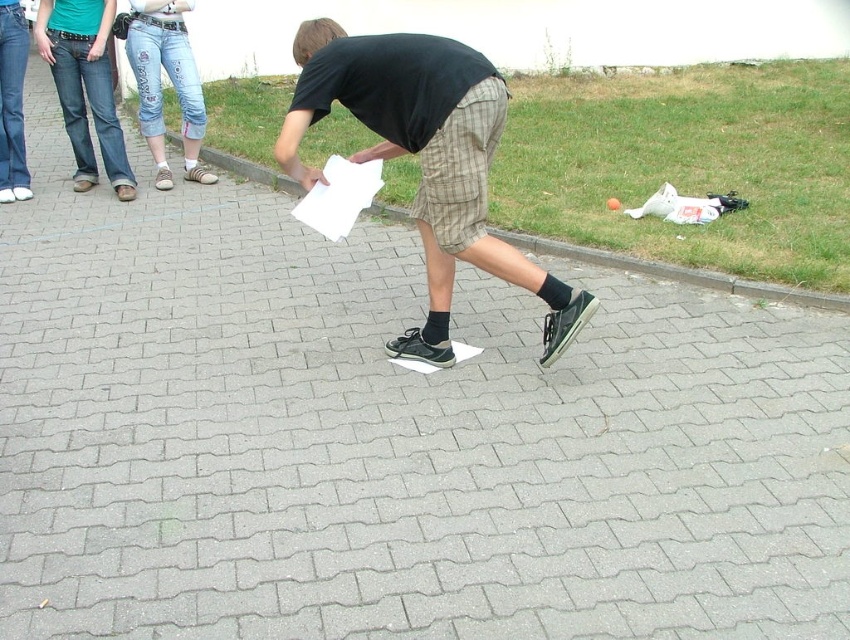
Question: Considering the relative positions of black matte shirt at center and denim jeans at upper left in the image provided, where is black matte shirt at center located with respect to denim jeans at upper left?

Choices:
 (A) right
 (B) left

Answer: (A)

Question: Does black matte shirt at center lie behind gray concrete curb at center?

Choices:
 (A) no
 (B) yes

Answer: (A)

Question: Estimate the real-world distances between objects in this image. Which object is farther from the gray concrete curb at center?

Choices:
 (A) black matte shirt at center
 (B) denim jeans at upper left

Answer: (A)

Question: Is black matte shirt at center to the right of gray concrete curb at center from the viewer's perspective?

Choices:
 (A) yes
 (B) no

Answer: (A)

Question: Which point is closer to the camera taking this photo?

Choices:
 (A) (146, 99)
 (B) (289, 131)
 (C) (596, 250)

Answer: (B)

Question: Which point is closer to the camera taking this photo?

Choices:
 (A) (239, 164)
 (B) (530, 266)

Answer: (B)